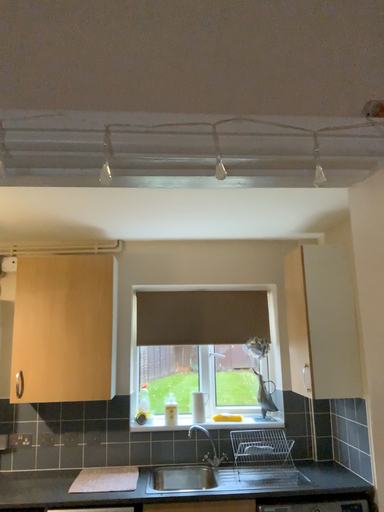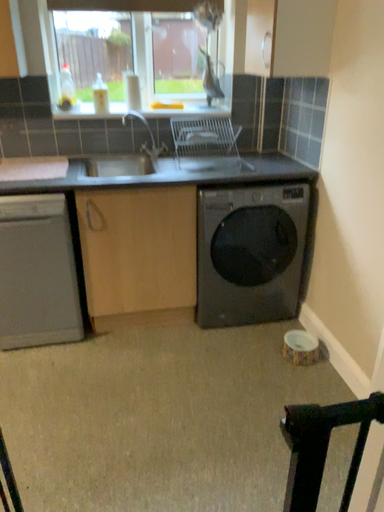
Question: How did the camera likely rotate when shooting the video?

Choices:
 (A) rotated right
 (B) rotated left

Answer: (A)